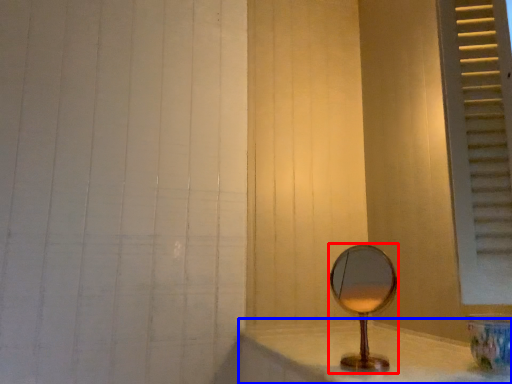
Question: Which point is further to the camera, mirror (highlighted by a red box) or counter top (highlighted by a blue box)?

Choices:
 (A) mirror
 (B) counter top

Answer: (A)